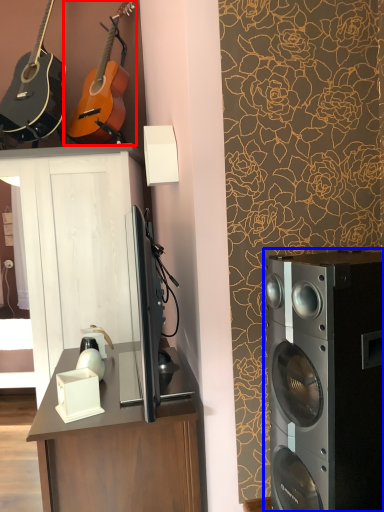
Question: Which of the following is the farthest to the observer, guitar (highlighted by a red box) or home appliance (highlighted by a blue box)?

Choices:
 (A) guitar
 (B) home appliance

Answer: (A)